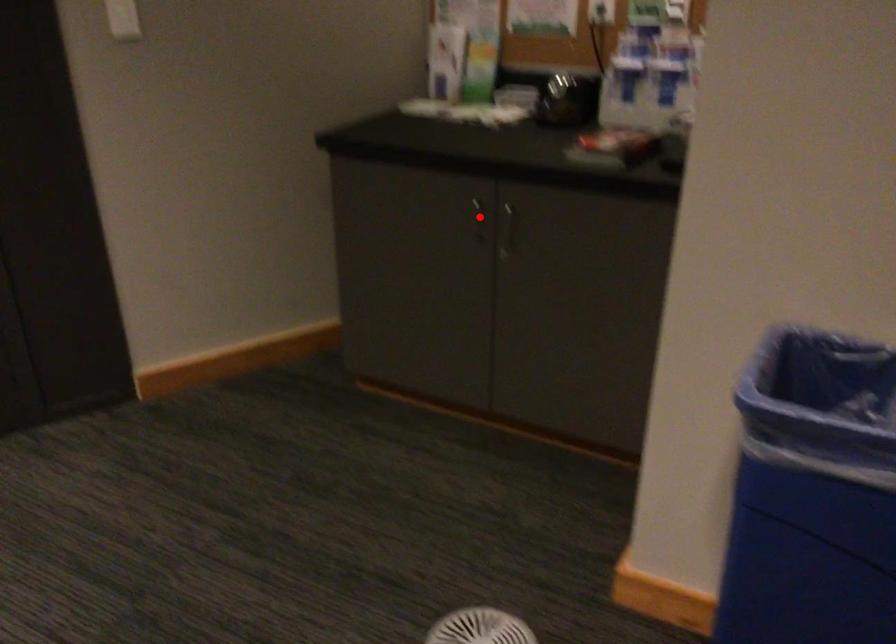
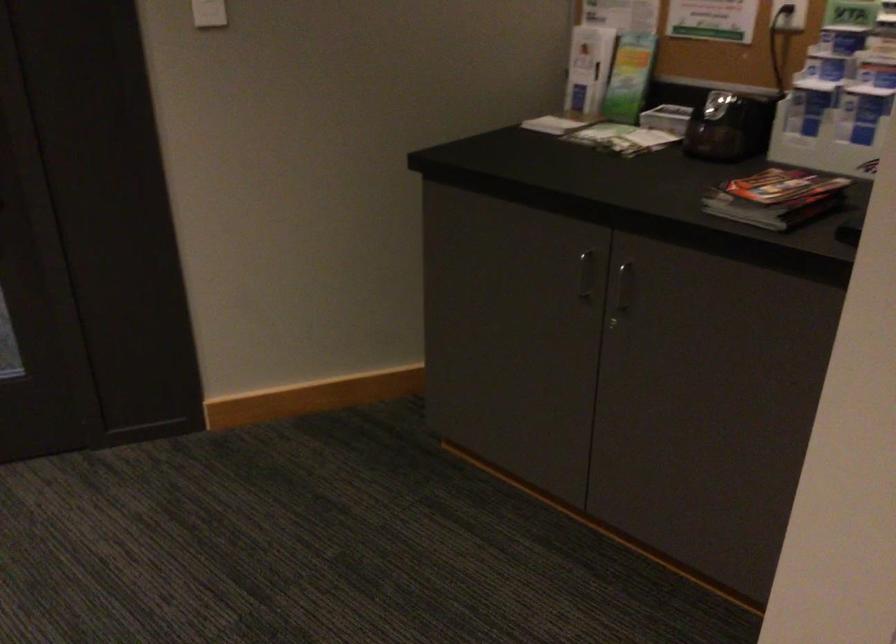
Question: A red point is marked in image1. In image2, is the corresponding 3D point closer to the camera or farther? Reply with the corresponding letter.

Choices:
 (A) The corresponding 3D point is closer.
 (B) The corresponding 3D point is farther.

Answer: (A)